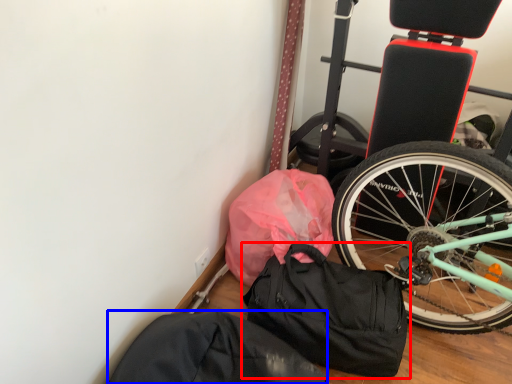
Question: Which of the following is the closest to the observer, luggage and bags (highlighted by a red box) or sack (highlighted by a blue box)?

Choices:
 (A) luggage and bags
 (B) sack

Answer: (B)